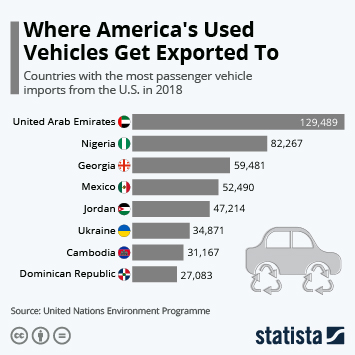
Identify the location of right front window. click(299, 239).